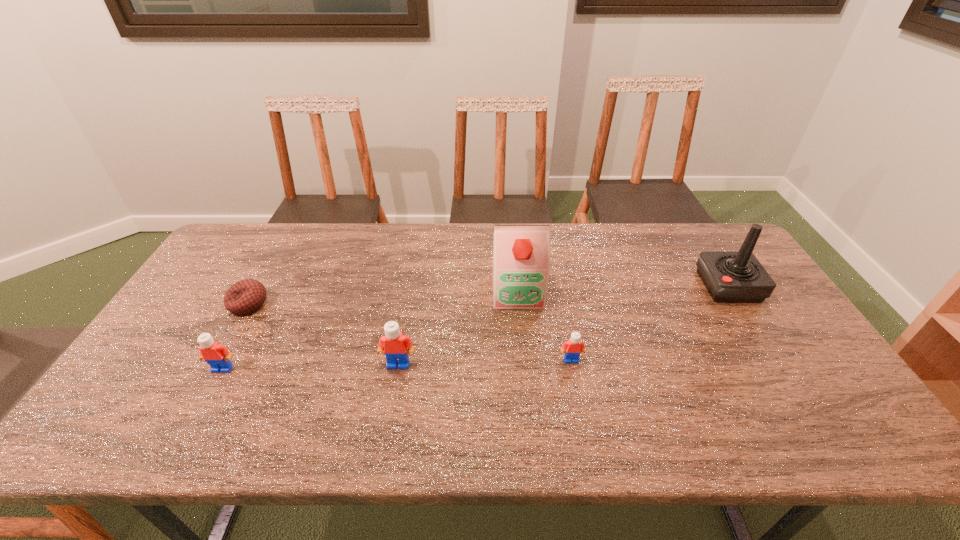
The height and width of the screenshot is (540, 960). I want to click on the leftmost Lego, so click(x=217, y=356).

At what (x,y) coordinates should I click in order to perform the action: click on the fourth tallest object. Please return your answer as a coordinate pair (x, y). The image size is (960, 540). Looking at the image, I should click on (217, 356).

Locate an element on the screen. Image resolution: width=960 pixels, height=540 pixels. the second Lego from right to left is located at coordinates (394, 344).

Image resolution: width=960 pixels, height=540 pixels. Find the location of `the fourth object from right to left`. the fourth object from right to left is located at coordinates (394, 344).

Where is `the shortest Lego`? Image resolution: width=960 pixels, height=540 pixels. the shortest Lego is located at coordinates (573, 346).

Find the location of `the fifth object from left to right`. the fifth object from left to right is located at coordinates (573, 346).

Where is `beanbag`? This screenshot has height=540, width=960. beanbag is located at coordinates (245, 296).

Locate an element on the screen. This screenshot has width=960, height=540. the rightmost object is located at coordinates (729, 276).

Where is `the fourth object from left to right`? This screenshot has width=960, height=540. the fourth object from left to right is located at coordinates (521, 262).

At what (x,y) coordinates should I click in order to perform the action: click on free location located 0.080m on the face of the fourth tallest object. Please return your answer as a coordinate pair (x, y). Image resolution: width=960 pixels, height=540 pixels. Looking at the image, I should click on (204, 401).